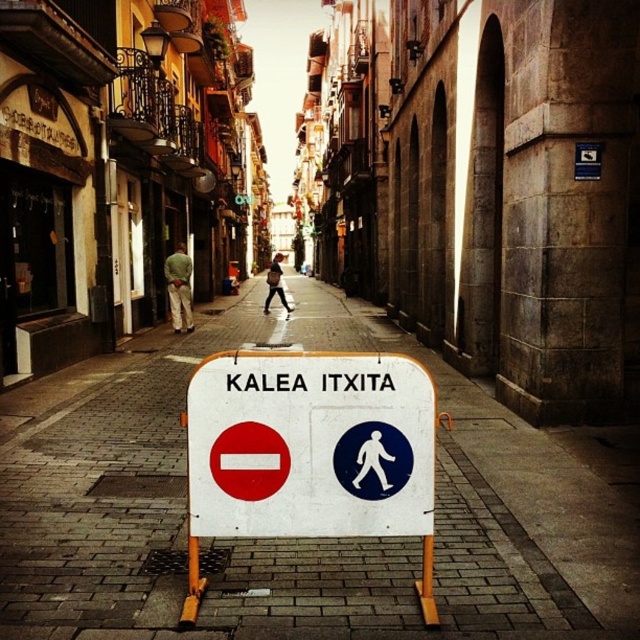
You are a delivery driver trying to navigate through the narrow street. There is a white brick pavement at center marked at point (x=298, y=540). Is this point on the street or on the buildings?

The white brick pavement at center is located at point (x=298, y=540), so this point is on the street.

You are a delivery driver trying to navigate through the narrow street. You see the white brick pavement at center and the white plastic sign at center. Which object is closer to you as you approach the street?

The white brick pavement at center is closer to you because it is in front of the white plastic sign at center.